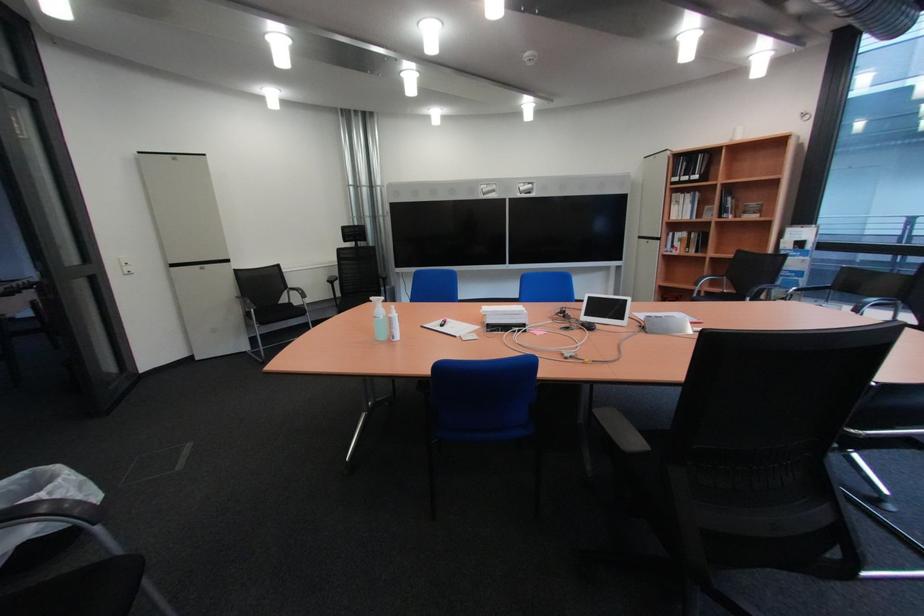
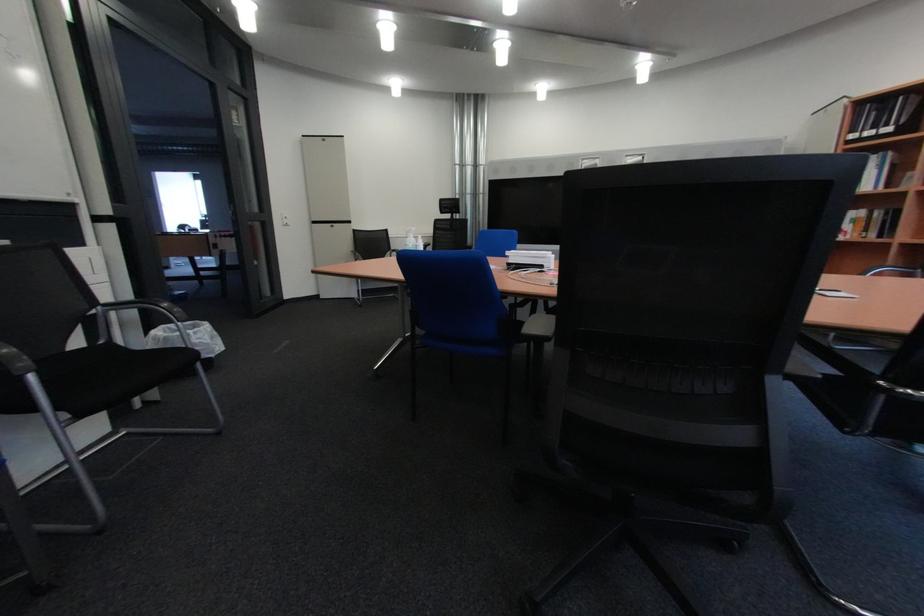
Question: The camera is either moving clockwise (left) or counter-clockwise (right) around the object. The first image is from the beginning of the video and the second image is from the end. Is the camera moving left or right when shooting the video?

Choices:
 (A) Left
 (B) Right

Answer: (B)